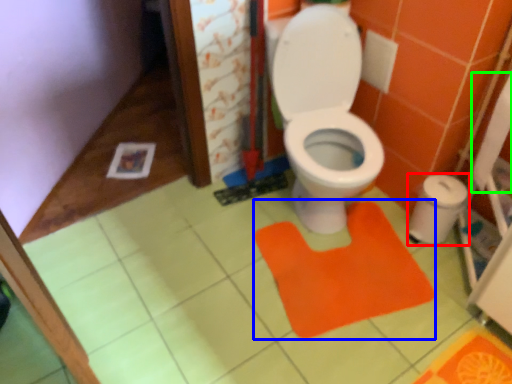
Question: Which object is the farthest from potty (highlighted by a red box)? Choose among these: doormat (highlighted by a blue box) or toilet paper (highlighted by a green box).

Choices:
 (A) doormat
 (B) toilet paper

Answer: (A)